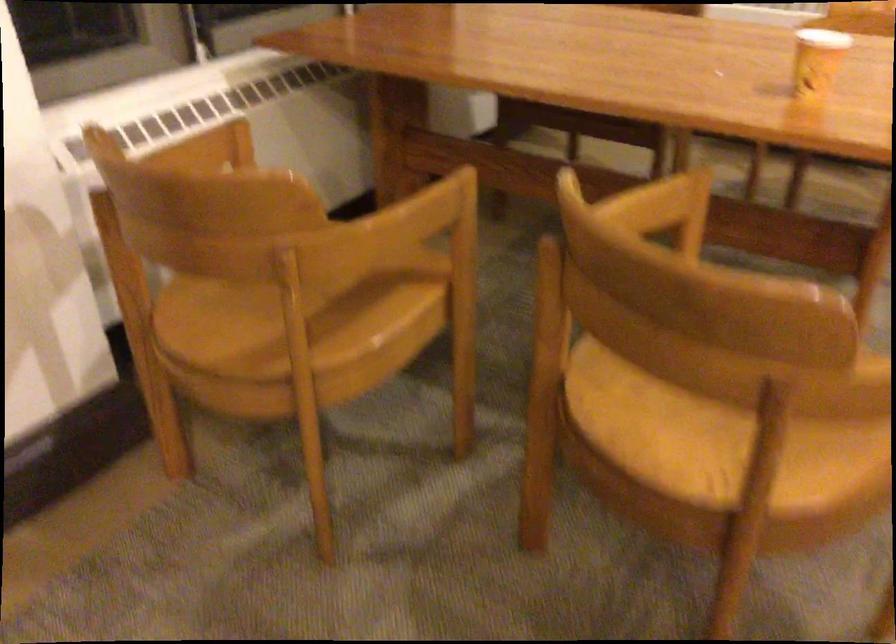
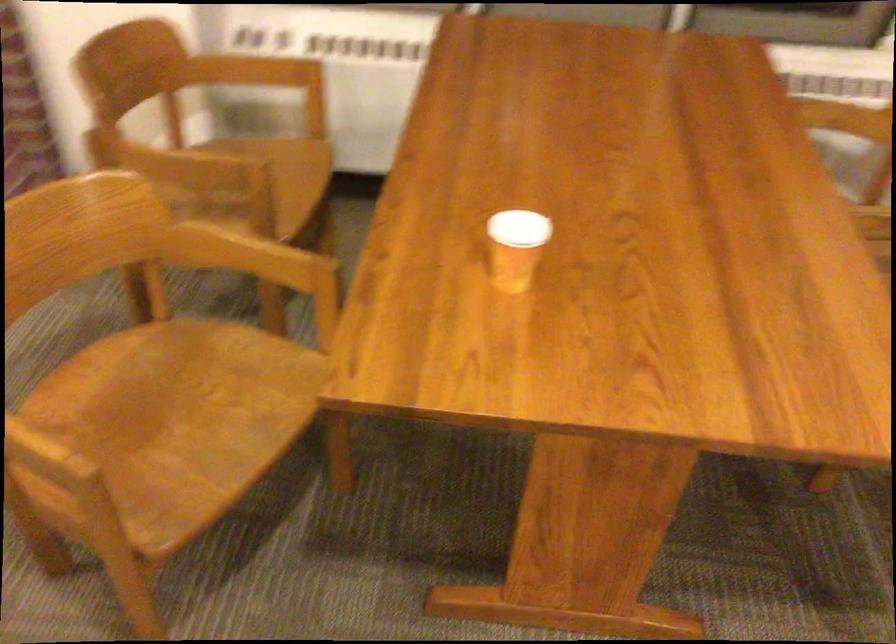
The point at [466,200] is marked in the first image. Where is the corresponding point in the second image?

(252, 182)